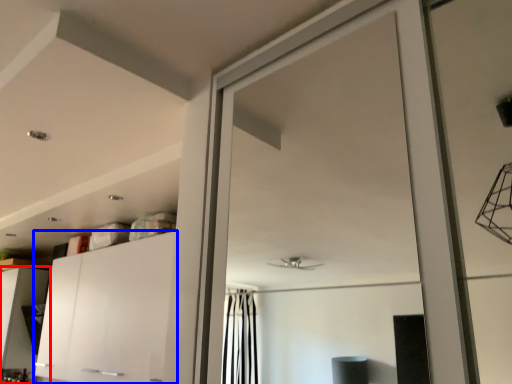
Question: Which point is further to the camera, cabinetry (highlighted by a red box) or cabinetry (highlighted by a blue box)?

Choices:
 (A) cabinetry
 (B) cabinetry

Answer: (A)